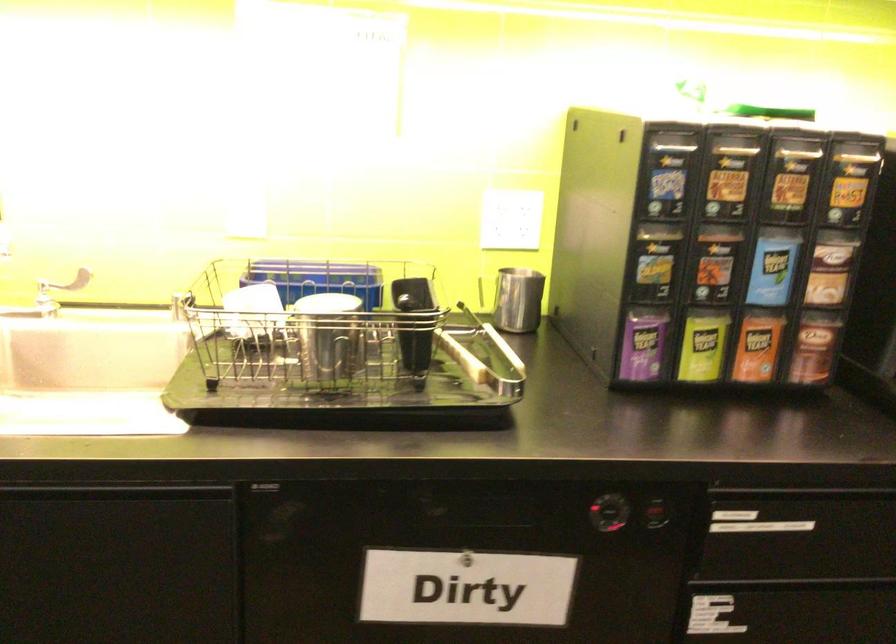
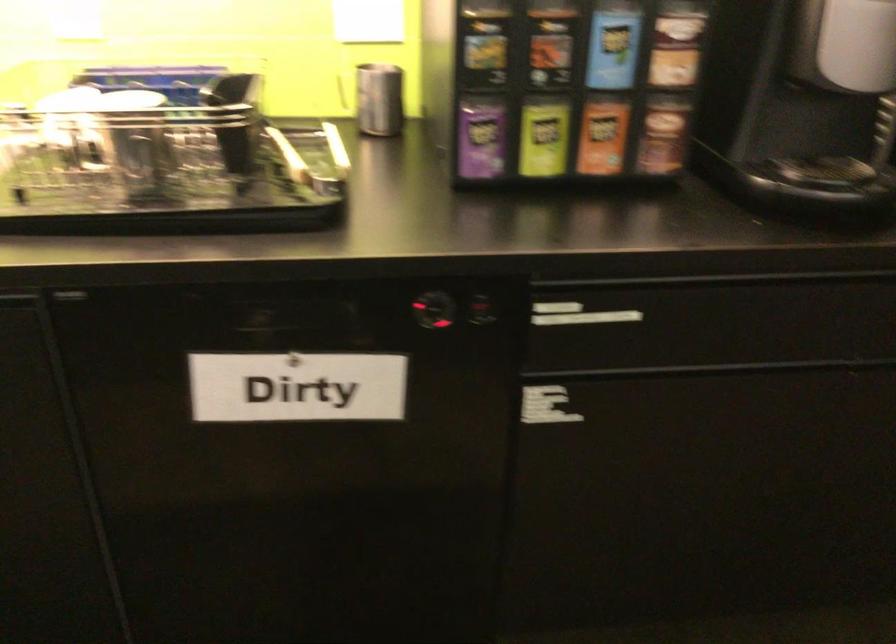
Where in the second image is the point corresponding to pixel 754 526 from the first image?

(578, 315)